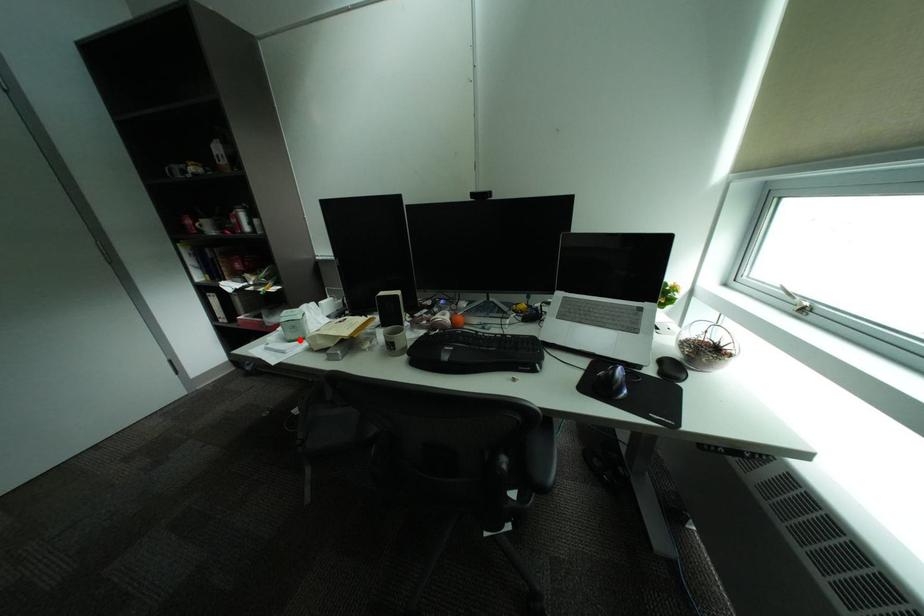
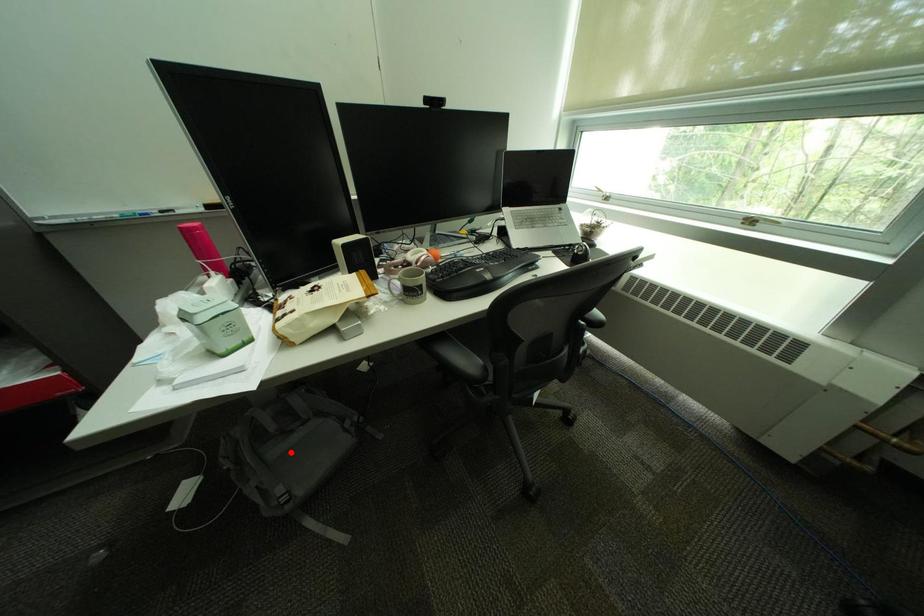
I am providing you with two images of the same scene from different viewpoints. A red point is marked on the first image and another point is marked on the second image. Does the point marked in image1 correspond to the same location as the one in image2?

No